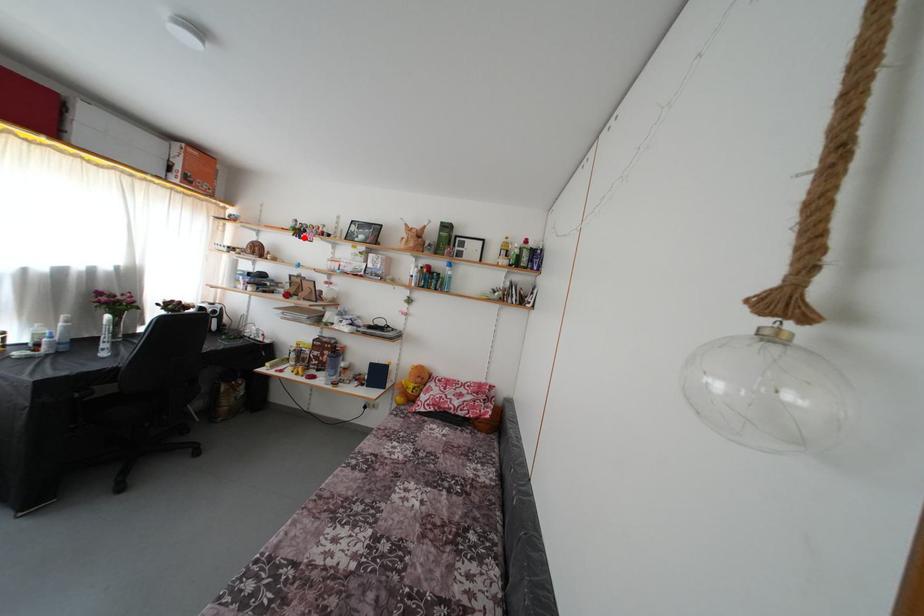
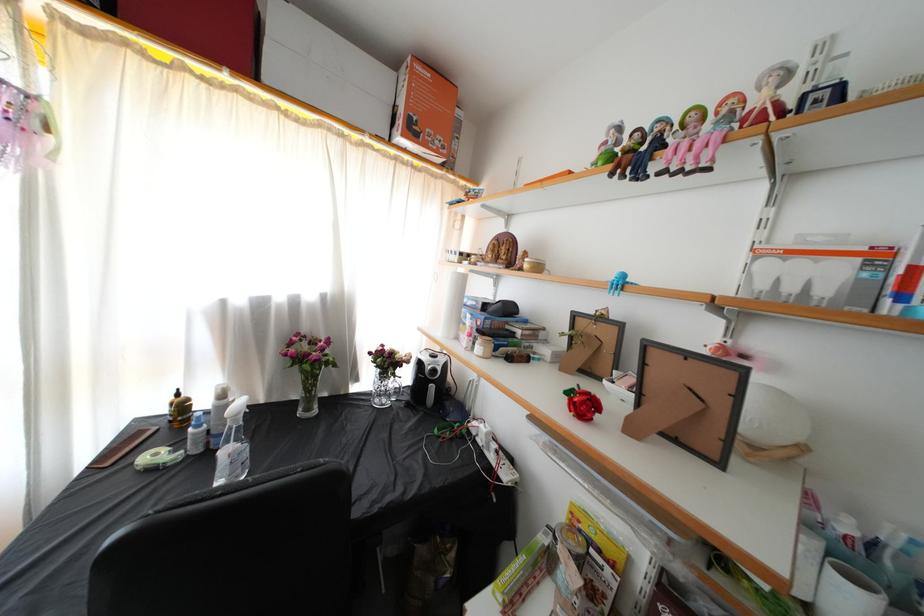
In the second image, find the point that corresponds to the highlighted location in the first image.

(638, 161)